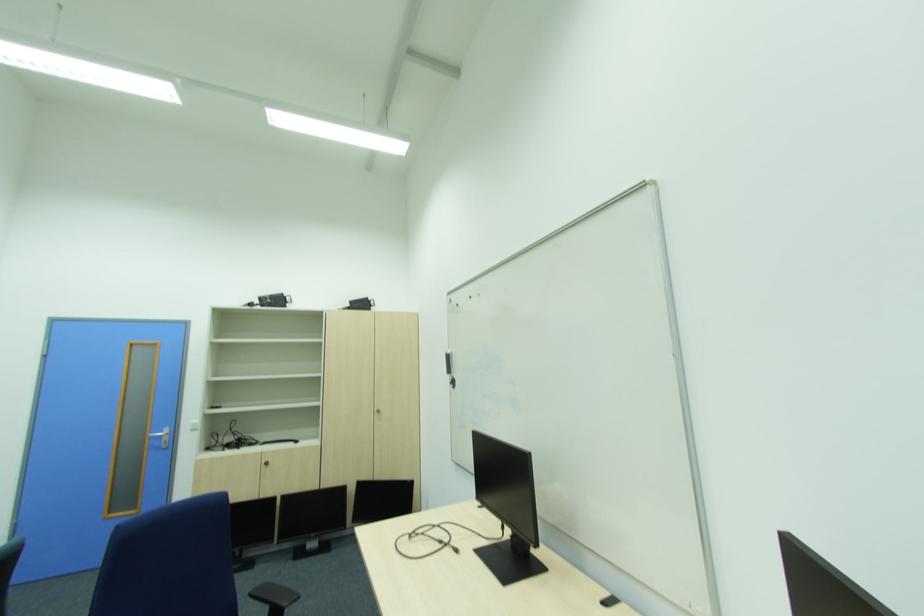
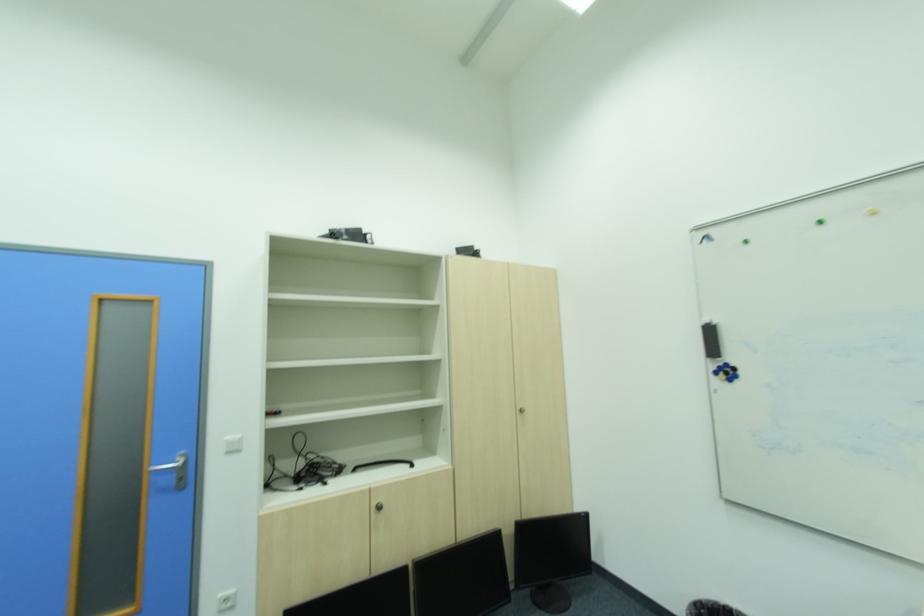
Locate, in the second image, the point that corresponds to the point at 282,498 in the first image.

(411, 570)